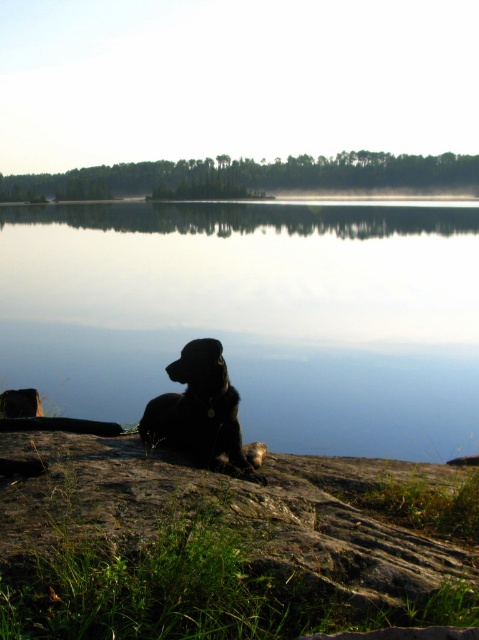
Can you confirm if transparent water at center is thinner than rough textured rock at lower center?

In fact, transparent water at center might be wider than rough textured rock at lower center.

Can you confirm if transparent water at center is positioned above rough textured rock at lower center?

Correct, transparent water at center is located above rough textured rock at lower center.

Does point (353, 340) come farther from viewer compared to point (145, 481)?

Yes, point (353, 340) is behind point (145, 481).

Locate an element on the screen. transparent water at center is located at coordinates (254, 316).

Which is more to the right, transparent water at center or black fur dog at lower center?

transparent water at center

Where is `transparent water at center`? This screenshot has height=640, width=479. transparent water at center is located at coordinates (254, 316).

Identify the location of transparent water at center. The image size is (479, 640). (254, 316).

Can you confirm if rough textured rock at lower center is wider than black fur dog at lower center?

Correct, the width of rough textured rock at lower center exceeds that of black fur dog at lower center.

Between rough textured rock at lower center and black fur dog at lower center, which one has more height?

black fur dog at lower center is taller.

Find the location of a particular element. The image size is (479, 640). rough textured rock at lower center is located at coordinates (228, 545).